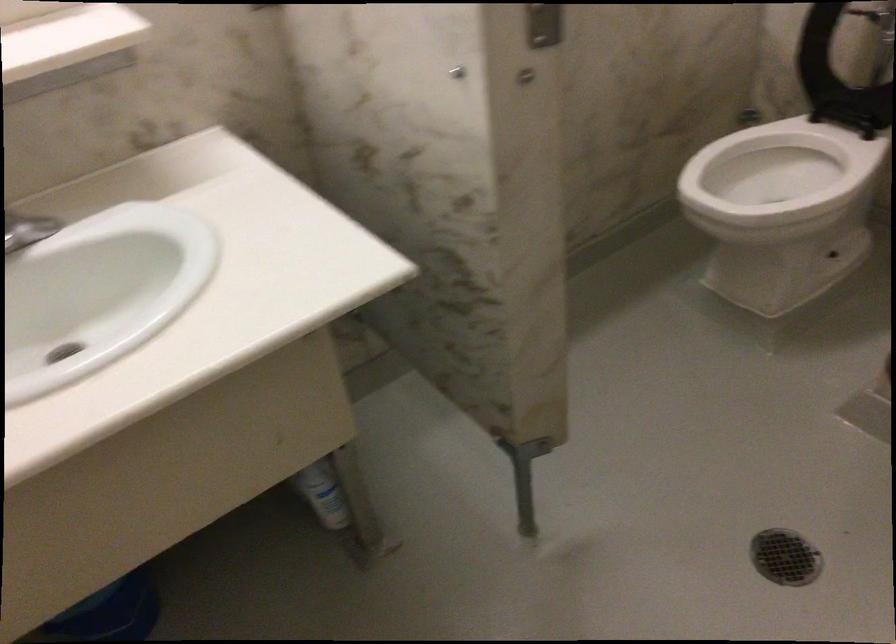
Describe the element at coordinates (778, 173) in the screenshot. I see `the black toilet seat` at that location.